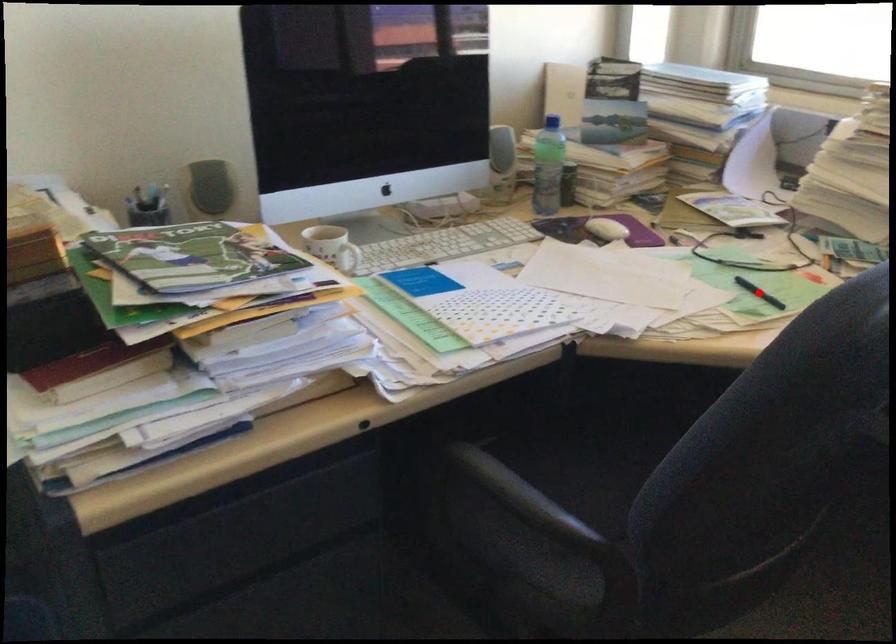
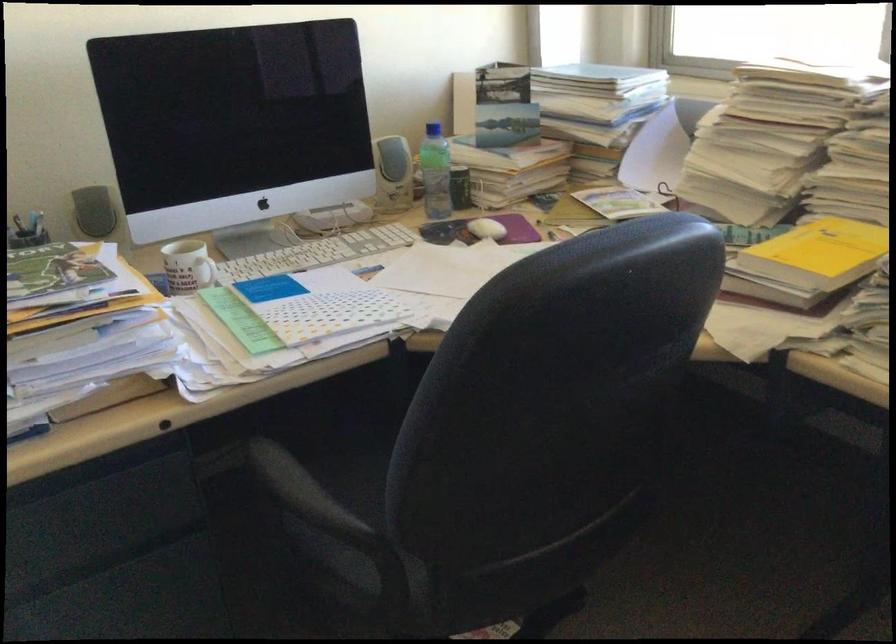
Question: I am providing you with two images of the same scene from different viewpoints. A red point is marked on the first image. At the location where the point appears in image 1, is it still visible in image 2?

Choices:
 (A) Yes
 (B) No

Answer: (B)